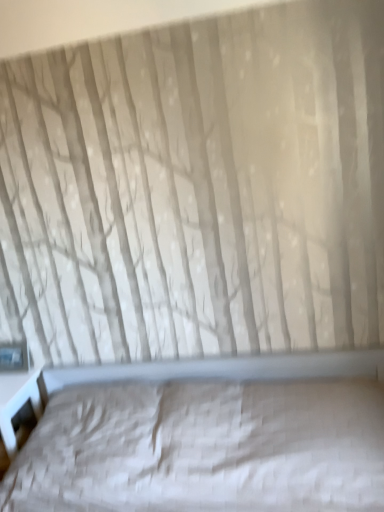
Question: Based on their sizes in the image, would you say transparent glass window at lower left is bigger or smaller than white quilted bed at center?

Choices:
 (A) big
 (B) small

Answer: (B)

Question: Considering the positions of point (21, 362) and point (167, 362), is point (21, 362) closer or farther from the camera than point (167, 362)?

Choices:
 (A) closer
 (B) farther

Answer: (B)

Question: From the image's perspective, is transparent glass window at lower left above or below white quilted bed at center?

Choices:
 (A) above
 (B) below

Answer: (A)

Question: From the image's perspective, is white quilted bed at center located above or below transparent glass window at lower left?

Choices:
 (A) below
 (B) above

Answer: (A)

Question: Is point (170, 364) positioned closer to the camera than point (1, 353)?

Choices:
 (A) farther
 (B) closer

Answer: (B)

Question: Is white quilted bed at center inside or outside of transparent glass window at lower left?

Choices:
 (A) inside
 (B) outside

Answer: (B)

Question: Considering their positions, is white quilted bed at center located in front of or behind transparent glass window at lower left?

Choices:
 (A) behind
 (B) front

Answer: (B)